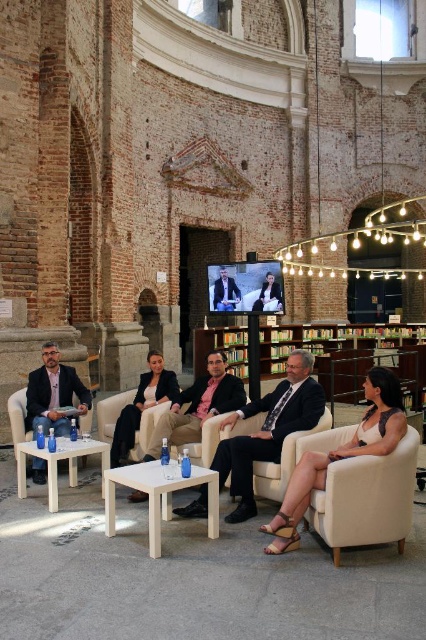
You are organizing a book fair in the venue and need to place a large display stand that requires 3 meters of space. The wooden bookshelf at center and the matte black armchair at center are in the way. Which object should you move to free up more space?

Result: The wooden bookshelf at center is larger in size than the matte black armchair at center, so you should move the wooden bookshelf at center to free up more space.

You are a guest at an event in this venue and need to find the wooden bookshelf at center. You are currently standing at the point marked by the coordinates point (322, 355). Which direction should you walk to reach the wooden bookshelf at center?

The point (322, 355) indicates the wooden bookshelf at center, so you are already at the wooden bookshelf at center.

You are organizing a photography session in this venue and want to ensure that the matte black suit at center is fully visible in the photo without being blocked by the wooden bookshelf at center. Based on their heights, can you confirm if the suit will be visible when positioned in front of the bookshelf?

The wooden bookshelf at center has a greater height compared to matte black suit at center. Therefore, if the suit is placed in front of the bookshelf, the top of the suit may be visible, but the bookshelf will likely block the upper portion of the suit since it is taller.